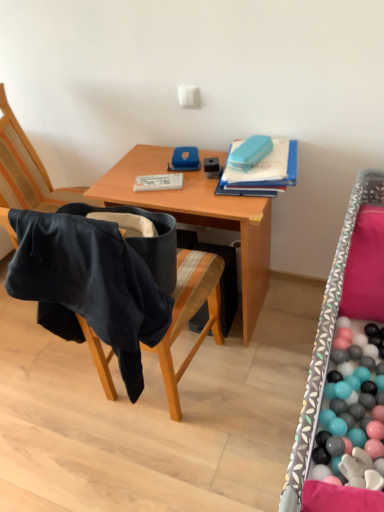
Where is `vacant space positioned to the left of black fabric chair at left`? The width and height of the screenshot is (384, 512). vacant space positioned to the left of black fabric chair at left is located at coordinates (48, 401).